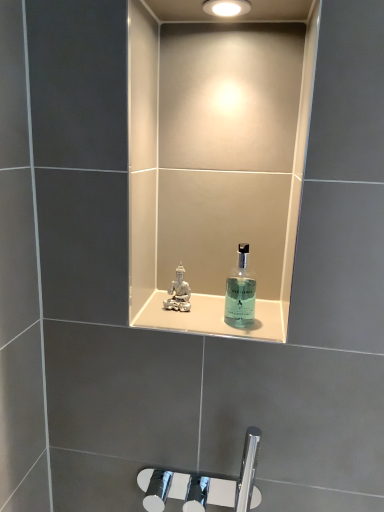
Identify the location of free spot above translucent glass shelf at center (from a real-world perspective). (212, 312).